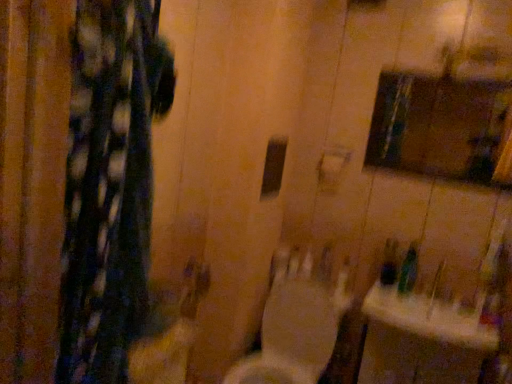
Question: Considering their positions, is white glossy sink at lower right located in front of or behind green plastic bottle at lower right?

Choices:
 (A) front
 (B) behind

Answer: (A)

Question: Does point (424, 317) appear closer or farther from the camera than point (403, 288)?

Choices:
 (A) farther
 (B) closer

Answer: (B)

Question: Which object is positioned farthest from the green plastic bottle at lower right?

Choices:
 (A) matte glass medicine cabinet at upper right
 (B) white glossy toilet at center
 (C) white glossy sink at lower right

Answer: (A)

Question: Based on their relative distances, which object is nearer to the white glossy toilet at center?

Choices:
 (A) matte glass medicine cabinet at upper right
 (B) white glossy sink at lower right
 (C) green plastic bottle at lower right

Answer: (B)